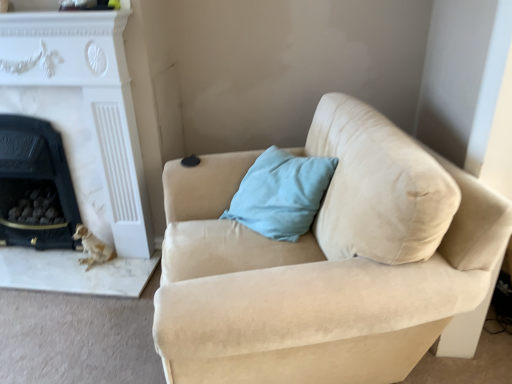
Question: From the image's perspective, is black marble fireplace at left, which appears as the 1th fireplace when viewed from the left, above or below white marble fireplace at left, marked as the second fireplace in a left-to-right arrangement?

Choices:
 (A) above
 (B) below

Answer: (B)

Question: Is point (33, 195) closer or farther from the camera than point (104, 170)?

Choices:
 (A) closer
 (B) farther

Answer: (B)

Question: Which object is the farthest from the light blue fabric pillow at upper right?

Choices:
 (A) beige suede couch at center
 (B) white marble fireplace at left, which is counted as the first fireplace, starting from the right
 (C) black marble fireplace at left, the 2th fireplace viewed from the right

Answer: (C)

Question: Which is nearer to the black marble fireplace at left, which appears as the 1th fireplace when viewed from the left?

Choices:
 (A) beige suede couch at center
 (B) light blue fabric pillow at upper right
 (C) white marble fireplace at left, which is counted as the first fireplace, starting from the right

Answer: (C)